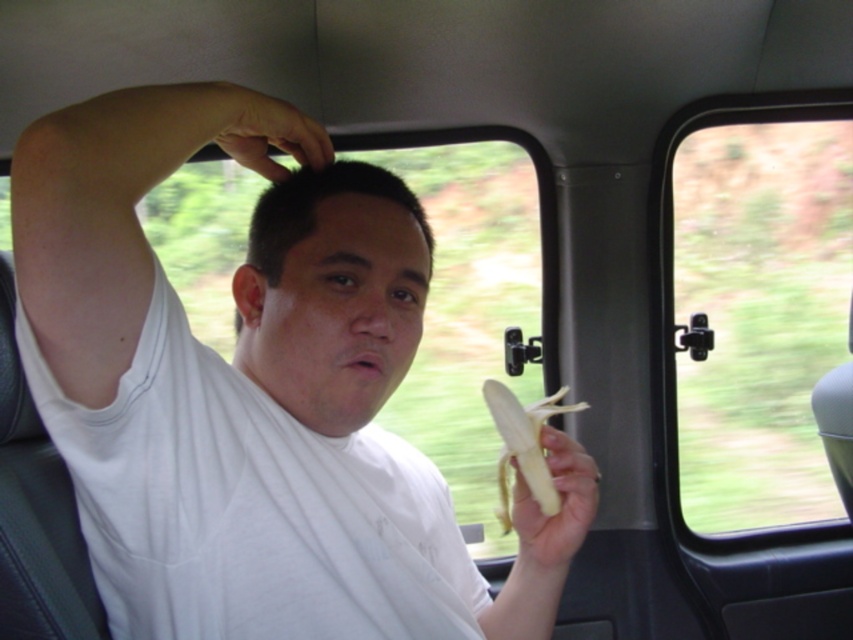
Question: Which of the following is the farthest from the observer?

Choices:
 (A) (558, 484)
 (B) (543, 492)
 (C) (270, 106)

Answer: (B)

Question: Which point appears farthest from the camera in this image?

Choices:
 (A) (746, 177)
 (B) (374, 243)
 (C) (233, 152)
 (D) (380, 493)

Answer: (A)

Question: Does transparent glass window at right appear on the right side of matte white head at center?

Choices:
 (A) no
 (B) yes

Answer: (B)

Question: Estimate the real-world distances between objects in this image. Which object is closer to the transparent glass window at right?

Choices:
 (A) yellow matte banana at lower center
 (B) yellow matte banana at right
 (C) matte white head at center

Answer: (B)

Question: Does matte white head at center have a greater width compared to matte black hand at upper center?

Choices:
 (A) yes
 (B) no

Answer: (A)

Question: Does matte white head at center come behind matte black hand at upper center?

Choices:
 (A) yes
 (B) no

Answer: (A)